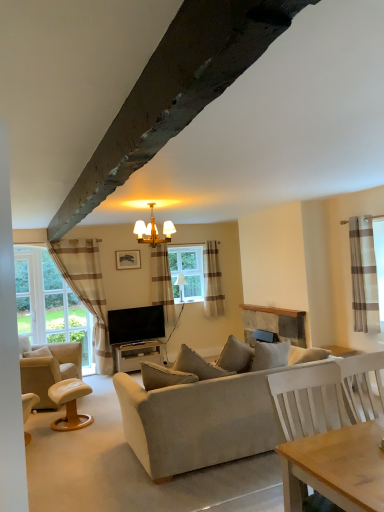
Question: From a real-world perspective, relative to wooden picture frame at upper center, is beige fabric couch at center vertically above or below?

Choices:
 (A) below
 (B) above

Answer: (A)

Question: From the image's perspective, relative to wooden picture frame at upper center, is beige fabric couch at center above or below?

Choices:
 (A) above
 (B) below

Answer: (B)

Question: Estimate the real-world distances between objects in this image. Which object is farther from the brown striped curtain at center, marked as the third curtain in a front-to-back arrangement?

Choices:
 (A) stone fireplace at center
 (B) wooden chandelier at center, placed as the second lamp when sorted from bottom to top
 (C) light brown leather stool at lower left
 (D) wooden picture frame at upper center
 (E) beige striped curtain at center, the second curtain viewed from the right

Answer: (C)

Question: Based on their relative distances, which object is farther from the beige striped curtain at center, which is the 3th curtain from left to right?

Choices:
 (A) beige leather chair at left
 (B) wooden chandelier at center, positioned as the 1th lamp in front-to-back order
 (C) light brown leather stool at lower left
 (D) beige striped curtain at left
 (E) white fabric lampshade at center, which is counted as the 2th lamp, starting from the front

Answer: (C)